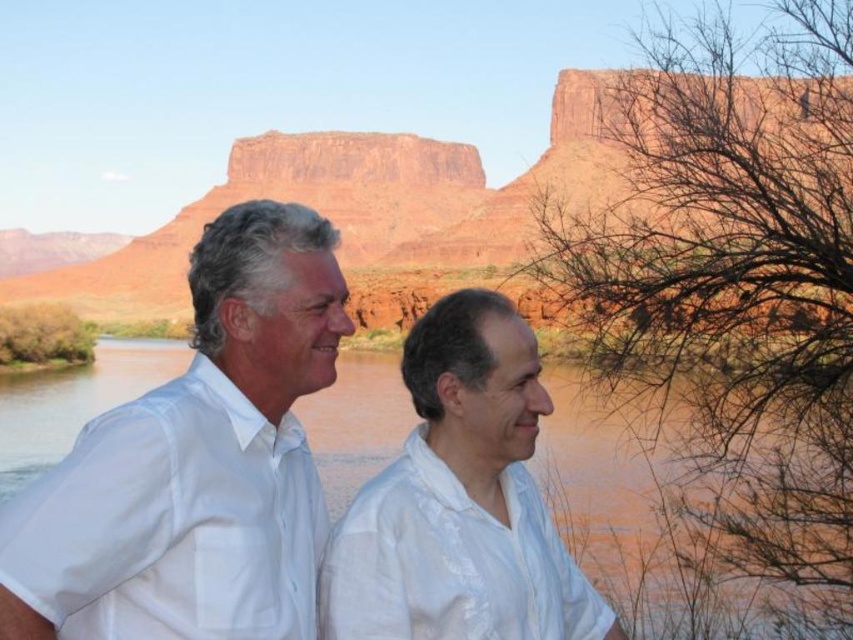
You are a hiker planning to cross the brown sedimentary water at center. The point you need to step on is at coordinate point (619, 516). Is this point safe for crossing?

The brown sedimentary water at center is represented by point (619, 516), so stepping on this point would mean entering the water. The safety of crossing depends on factors like water depth and current, which are not provided in the scene description. Proceed with caution and assess the conditions on site.

You are an artist planning to paint the scene. You want to ensure the white cotton shirt at left and the brown sedimentary water at center are proportionally accurate. Which object should be drawn smaller in your painting?

The white cotton shirt at left should be drawn smaller because it has a smaller size compared to the brown sedimentary water at center.